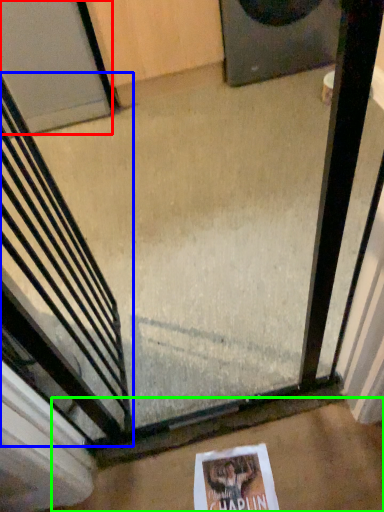
Question: Which object is the closest to the door (highlighted by a red box)? Choose among these: escalator (highlighted by a blue box) or concrete (highlighted by a green box).

Choices:
 (A) escalator
 (B) concrete

Answer: (A)